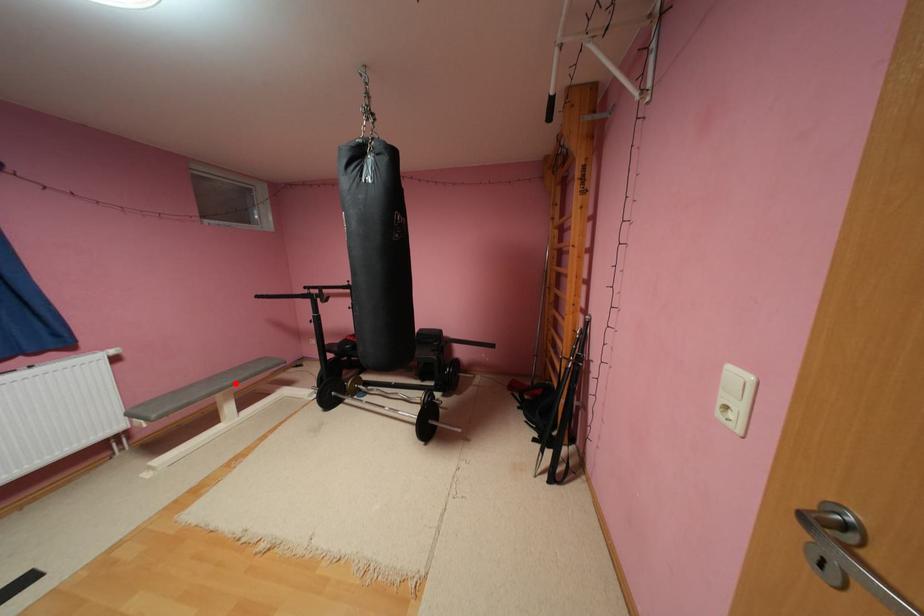
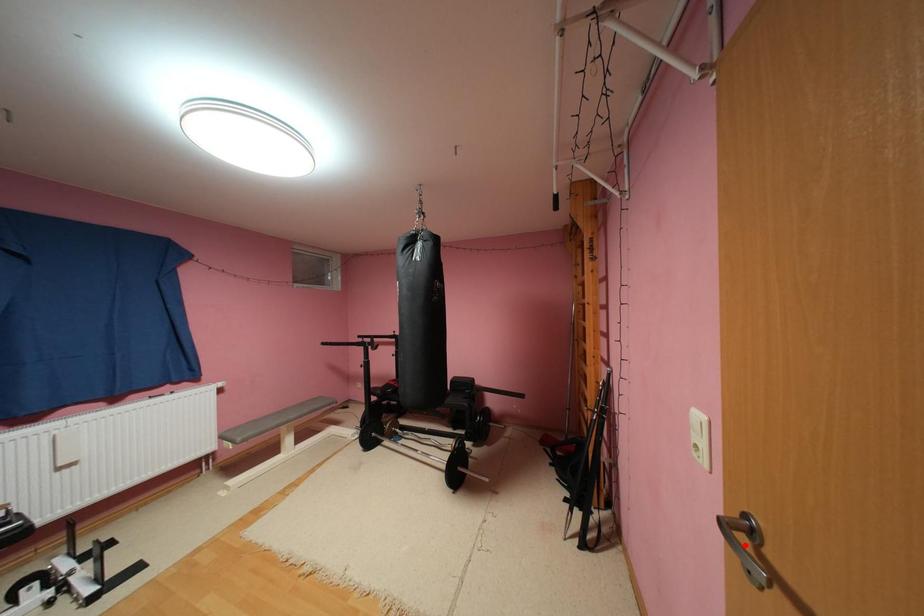
I am providing you with two images of the same scene from different viewpoints. A red point is marked on the first image and another point is marked on the second image. Is the marked point in image1 the same physical position as the marked point in image2?

No